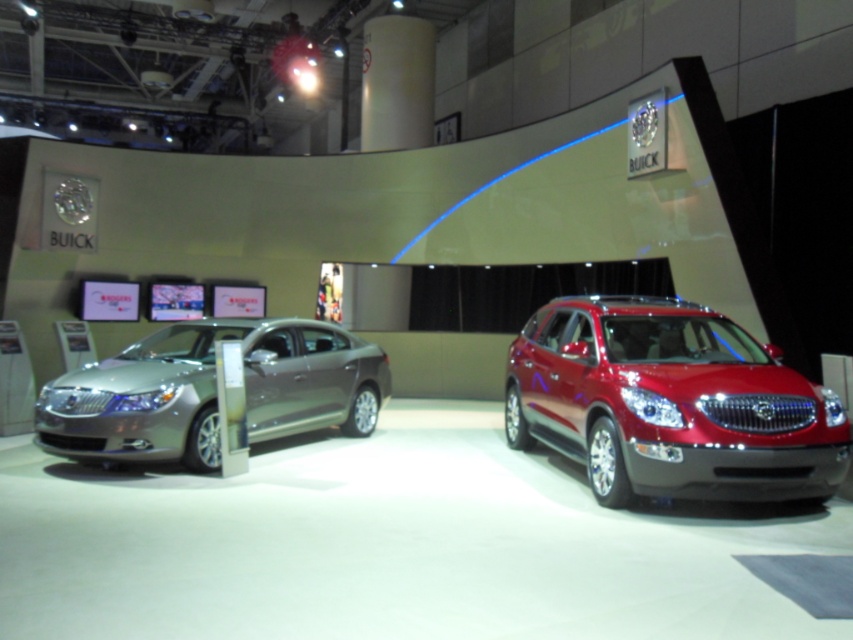
Between glossy red suv at center and satin silver sedan at left, which one appears on the right side from the viewer's perspective?

glossy red suv at center

Describe the element at coordinates (670, 403) in the screenshot. I see `glossy red suv at center` at that location.

At what (x,y) coordinates should I click in order to perform the action: click on glossy red suv at center. Please return your answer as a coordinate pair (x, y). This screenshot has height=640, width=853. Looking at the image, I should click on (670, 403).